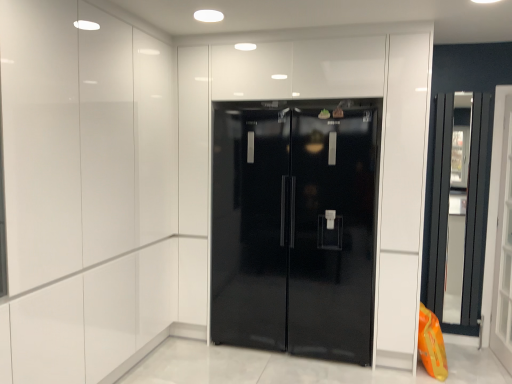
You are a GUI agent. You are given a task and a screenshot of the screen. Output one action in this format:
    pyautogui.click(x=<x>, y=<y>)
    Task: Click on the glossy black refrigerator at center
    
    Given the screenshot: What is the action you would take?
    tap(294, 226)

Describe the element at coordinates (294, 226) in the screenshot. Image resolution: width=512 pixels, height=384 pixels. I see `glossy black refrigerator at center` at that location.

Measure the distance between point (291, 268) and camera.

The distance of point (291, 268) from camera is 3.12 meters.

The image size is (512, 384). I want to click on glossy black refrigerator at center, so 294,226.